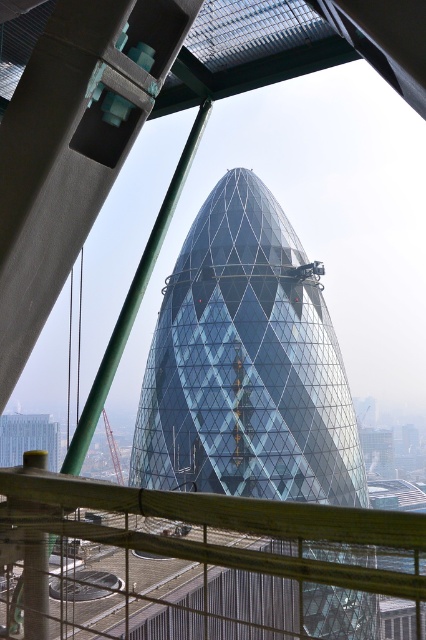
Question: Does wooden rail at center lie behind transparent glass tower at center?

Choices:
 (A) no
 (B) yes

Answer: (A)

Question: Which point is farther from the camera taking this photo?

Choices:
 (A) (265, 381)
 (B) (17, 477)

Answer: (A)

Question: Which of the following is the farthest from the observer?

Choices:
 (A) transparent glass tower at center
 (B) wooden rail at center

Answer: (A)

Question: Considering the relative positions of wooden rail at center and transparent glass tower at center in the image provided, where is wooden rail at center located with respect to transparent glass tower at center?

Choices:
 (A) left
 (B) right

Answer: (B)

Question: Which object is closer to the camera taking this photo?

Choices:
 (A) transparent glass tower at center
 (B) wooden rail at center

Answer: (B)

Question: From the image, what is the correct spatial relationship of wooden rail at center in relation to transparent glass tower at center?

Choices:
 (A) left
 (B) right

Answer: (B)